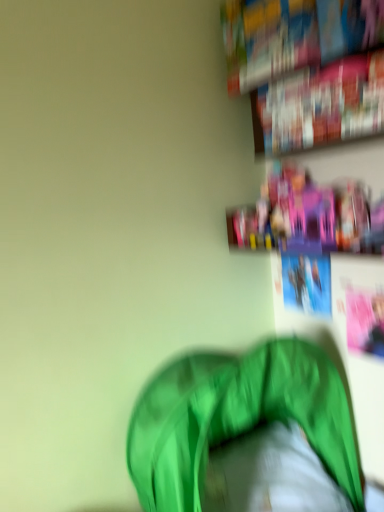
Find the location of a particular element. Image resolution: width=384 pixels, height=512 pixels. pink plastic toys at upper right is located at coordinates (309, 215).

The height and width of the screenshot is (512, 384). Identify the location of green fabric bean bag at lower center. (236, 418).

This screenshot has height=512, width=384. In order to click on hardcover book at upper right, which is the 2th book in bottom-to-top order in this screenshot , I will do tap(291, 35).

Based on the photo, measure the distance between point [266,70] and camera.

Point [266,70] and camera are 1.52 meters apart from each other.

Find the location of `hardcover book at upper right, the 1th book positioned from the bottom`. hardcover book at upper right, the 1th book positioned from the bottom is located at coordinates coord(322,104).

Locate an element on the screen. pink plastic toys at upper right is located at coordinates (309, 215).

Is green fabric bean bag at lower center oriented away from pink plastic toys at upper right?

green fabric bean bag at lower center does not have its back to pink plastic toys at upper right.

Find the location of a particular element. This screenshot has width=384, height=512. bean bag chair on the left side of pink plastic toys at upper right is located at coordinates (236, 418).

Would you say green fabric bean bag at lower center is outside pink plastic toys at upper right?

green fabric bean bag at lower center lies outside pink plastic toys at upper right's area.

How many degrees apart are the facing directions of green fabric bean bag at lower center and pink plastic toys at upper right?

The angle between the facing direction of green fabric bean bag at lower center and the facing direction of pink plastic toys at upper right is 0.833 degrees.

From the image's perspective, is pink plastic toys at upper right located above hardcover book at upper right, the 1th book positioned from the bottom?

Actually, pink plastic toys at upper right appears below hardcover book at upper right, the 1th book positioned from the bottom, in the image.

Considering the positions of points (347, 214) and (375, 62), is point (347, 214) farther from camera compared to point (375, 62)?

Yes, it is.

Between pink plastic toys at upper right and hardcover book at upper right, marked as the 2th book in a top-to-bottom arrangement, which one has larger size?

Bigger between the two is pink plastic toys at upper right.

Based on their positions, is pink plastic toys at upper right located to the left or right of hardcover book at upper right, marked as the 2th book in a top-to-bottom arrangement?

In the image, pink plastic toys at upper right appears on the left side of hardcover book at upper right, marked as the 2th book in a top-to-bottom arrangement.

Does green fabric bean bag at lower center come behind hardcover book at upper right, marked as the 2th book in a top-to-bottom arrangement?

No, green fabric bean bag at lower center is closer to the viewer.

From a real-world perspective, is green fabric bean bag at lower center under hardcover book at upper right, marked as the 2th book in a top-to-bottom arrangement?

Yes, from a real-world perspective, green fabric bean bag at lower center is under hardcover book at upper right, marked as the 2th book in a top-to-bottom arrangement.

Could you tell me if green fabric bean bag at lower center is turned towards hardcover book at upper right, marked as the 2th book in a top-to-bottom arrangement?

No, green fabric bean bag at lower center is not facing towards hardcover book at upper right, marked as the 2th book in a top-to-bottom arrangement.

Does green fabric bean bag at lower center have a lesser height compared to hardcover book at upper right, the 1th book positioned from the bottom?

No.

Is hardcover book at upper right, placed as the 1th book when sorted from top to bottom, closer to the viewer compared to green fabric bean bag at lower center?

No.

Consider the image. Are hardcover book at upper right, which is the 2th book in bottom-to-top order, and green fabric bean bag at lower center located far from each other?

hardcover book at upper right, which is the 2th book in bottom-to-top order, is positioned a significant distance from green fabric bean bag at lower center.

From the image's perspective, is hardcover book at upper right, which is the 2th book in bottom-to-top order, located above green fabric bean bag at lower center?

→ Yes, from the image's perspective, hardcover book at upper right, which is the 2th book in bottom-to-top order, is on top of green fabric bean bag at lower center.

Which of these two, hardcover book at upper right, which is the 2th book in bottom-to-top order, or green fabric bean bag at lower center, is wider?

green fabric bean bag at lower center.

From the image's perspective, which book is the 2nd one above the pink plastic toys at upper right? Please provide its 2D coordinates.

[(291, 35)]

Is pink plastic toys at upper right looking in the opposite direction of hardcover book at upper right, placed as the 1th book when sorted from top to bottom?

No, pink plastic toys at upper right is not facing away from hardcover book at upper right, placed as the 1th book when sorted from top to bottom.

Which is behind, pink plastic toys at upper right or hardcover book at upper right, which is the 2th book in bottom-to-top order?

hardcover book at upper right, which is the 2th book in bottom-to-top order.

From a real-world perspective, which is physically below, pink plastic toys at upper right or hardcover book at upper right, placed as the 1th book when sorted from top to bottom?

In real-world perspective, pink plastic toys at upper right is lower.

From a real-world perspective, does pink plastic toys at upper right stand above green fabric bean bag at lower center?

Yes.

In the scene shown: From their relative heights in the image, would you say pink plastic toys at upper right is taller or shorter than green fabric bean bag at lower center?

In the image, pink plastic toys at upper right appears to be shorter than green fabric bean bag at lower center.

Is pink plastic toys at upper right wider or thinner than green fabric bean bag at lower center?

pink plastic toys at upper right is thinner than green fabric bean bag at lower center.

From a real-world perspective, who is located lower, hardcover book at upper right, placed as the 1th book when sorted from top to bottom, or hardcover book at upper right, the 1th book positioned from the bottom?

hardcover book at upper right, the 1th book positioned from the bottom, from a real-world perspective.

Is hardcover book at upper right, the 1th book positioned from the bottom, at the back of hardcover book at upper right, placed as the 1th book when sorted from top to bottom?

hardcover book at upper right, placed as the 1th book when sorted from top to bottom, does not have its back to hardcover book at upper right, the 1th book positioned from the bottom.

Can we say hardcover book at upper right, placed as the 1th book when sorted from top to bottom, lies outside hardcover book at upper right, the 1th book positioned from the bottom?

hardcover book at upper right, placed as the 1th book when sorted from top to bottom, lies outside hardcover book at upper right, the 1th book positioned from the bottom,'s area.

Identify the location of book above the hardcover book at upper right, marked as the 2th book in a top-to-bottom arrangement (from the image's perspective). (291, 35).

This screenshot has width=384, height=512. I want to click on bean bag chair below the pink plastic toys at upper right (from a real-world perspective), so click(x=236, y=418).

Where is `book lying on the right of pink plastic toys at upper right`? This screenshot has width=384, height=512. book lying on the right of pink plastic toys at upper right is located at coordinates (322, 104).

Based on their spatial positions, is green fabric bean bag at lower center or hardcover book at upper right, which is the 2th book in bottom-to-top order, closer to hardcover book at upper right, marked as the 2th book in a top-to-bottom arrangement?

The object closer to hardcover book at upper right, marked as the 2th book in a top-to-bottom arrangement, is hardcover book at upper right, which is the 2th book in bottom-to-top order.

Which object lies further to the anchor point pink plastic toys at upper right, green fabric bean bag at lower center or hardcover book at upper right, which is the 2th book in bottom-to-top order?

green fabric bean bag at lower center is further to pink plastic toys at upper right.

Considering their positions, is hardcover book at upper right, placed as the 1th book when sorted from top to bottom, positioned further to green fabric bean bag at lower center than pink plastic toys at upper right?

The object further to green fabric bean bag at lower center is hardcover book at upper right, placed as the 1th book when sorted from top to bottom.

From the picture: Considering their positions, is pink plastic toys at upper right positioned closer to hardcover book at upper right, the 1th book positioned from the bottom, than green fabric bean bag at lower center?

pink plastic toys at upper right is positioned closer to the anchor hardcover book at upper right, the 1th book positioned from the bottom.

From the picture: Looking at the image, which one is located further to hardcover book at upper right, which is the 2th book in bottom-to-top order, green fabric bean bag at lower center or hardcover book at upper right, the 1th book positioned from the bottom?

green fabric bean bag at lower center is further to hardcover book at upper right, which is the 2th book in bottom-to-top order.

Consider the image. Which object lies further to the anchor point green fabric bean bag at lower center, pink plastic toys at upper right or hardcover book at upper right, the 1th book positioned from the bottom?

hardcover book at upper right, the 1th book positioned from the bottom, is further to green fabric bean bag at lower center.

Based on their spatial positions, is hardcover book at upper right, placed as the 1th book when sorted from top to bottom, or hardcover book at upper right, the 1th book positioned from the bottom, closer to green fabric bean bag at lower center?

hardcover book at upper right, the 1th book positioned from the bottom.

When comparing their distances from hardcover book at upper right, marked as the 2th book in a top-to-bottom arrangement, does hardcover book at upper right, placed as the 1th book when sorted from top to bottom, or pink plastic toys at upper right seem further?

pink plastic toys at upper right lies further to hardcover book at upper right, marked as the 2th book in a top-to-bottom arrangement, than the other object.

This screenshot has height=512, width=384. I want to click on shelf that lies between hardcover book at upper right, placed as the 1th book when sorted from top to bottom, and green fabric bean bag at lower center from top to bottom, so click(309, 215).

Locate an element on the screen. This screenshot has height=512, width=384. book between hardcover book at upper right, which is the 2th book in bottom-to-top order, and green fabric bean bag at lower center in the up-down direction is located at coordinates (322, 104).

Identify the location of shelf between hardcover book at upper right, the 1th book positioned from the bottom, and green fabric bean bag at lower center from top to bottom. Image resolution: width=384 pixels, height=512 pixels. (309, 215).

Where is `book between hardcover book at upper right, which is the 2th book in bottom-to-top order, and pink plastic toys at upper right, in the vertical direction`? book between hardcover book at upper right, which is the 2th book in bottom-to-top order, and pink plastic toys at upper right, in the vertical direction is located at coordinates (322, 104).